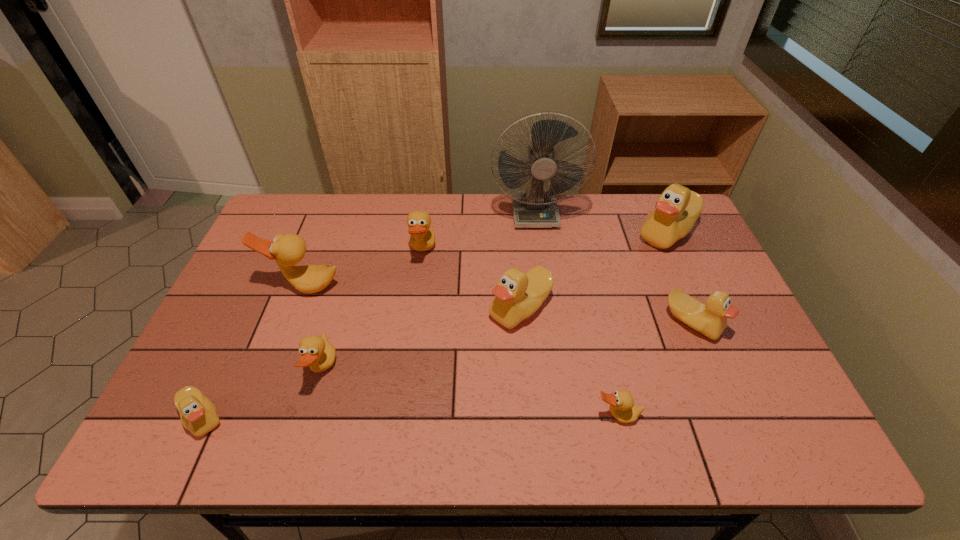
The height and width of the screenshot is (540, 960). Find the location of `vacant area located 0.180m at the beak of the fourth duck from right to left`. vacant area located 0.180m at the beak of the fourth duck from right to left is located at coordinates (423, 308).

Identify the location of free space located 0.190m at the beak of the fourth duck from right to left. The image size is (960, 540). (420, 308).

The image size is (960, 540). I want to click on free space located on the beak of the fourth duck from left to right, so click(492, 252).

Locate an element on the screen. vacant space located at the beak of the second smallest beige duck is located at coordinates (711, 368).

Locate an element on the screen. vacant space situated 0.160m on the beak of the second smallest tan duck is located at coordinates (400, 370).

You are a GUI agent. You are given a task and a screenshot of the screen. Output one action in this format:
    pyautogui.click(x=<x>, y=<y>)
    Task: Click on the fan present at the far edge
    The image size is (960, 540).
    Given the screenshot: What is the action you would take?
    pyautogui.click(x=534, y=208)

Locate an element on the screen. Image resolution: width=960 pixels, height=540 pixels. object at the near left corner is located at coordinates (x=198, y=414).

Locate an element on the screen. This screenshot has height=540, width=960. object present at the far right corner is located at coordinates (676, 211).

In the image, there is a desktop. Where is `free space at the far edge`? This screenshot has width=960, height=540. free space at the far edge is located at coordinates (369, 194).

Find the location of a particular element. The width and height of the screenshot is (960, 540). vacant area at the near edge is located at coordinates (303, 429).